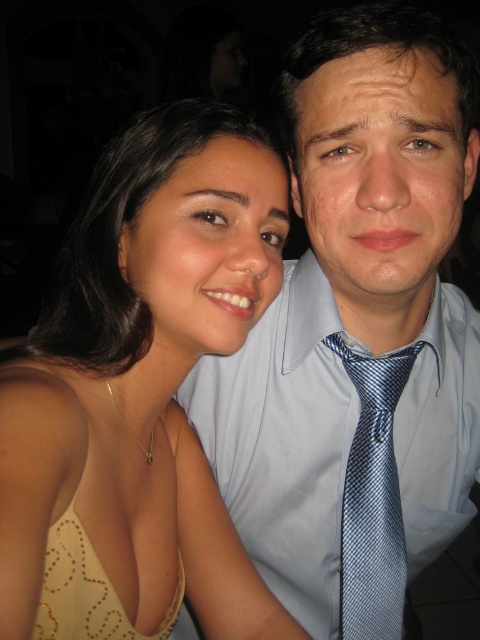
You are a photographer adjusting the lighting for a portrait. You notice the light blue silk shirt at upper right and the blue silk tie at center. Which clothing item should you focus your spotlight on to ensure it stands out more in the photo?

The light blue silk shirt at upper right is in front of the blue silk tie at center, so focusing the spotlight on the light blue silk shirt at upper right will make it stand out more in the photo.

You are a photographer at an event and notice the gold sequined dress at upper left and the blue silk tie at center. Which object is positioned higher in the frame?

The gold sequined dress at upper left is positioned higher in the frame than the blue silk tie at center.